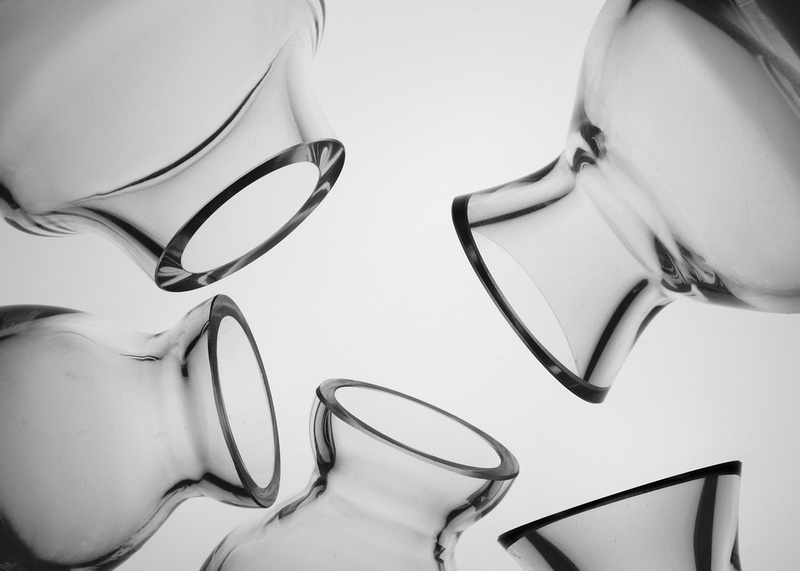
The width and height of the screenshot is (800, 571). Find the location of `glass jars`. glass jars is located at coordinates (544, 304), (249, 206), (186, 393), (380, 528), (672, 546).